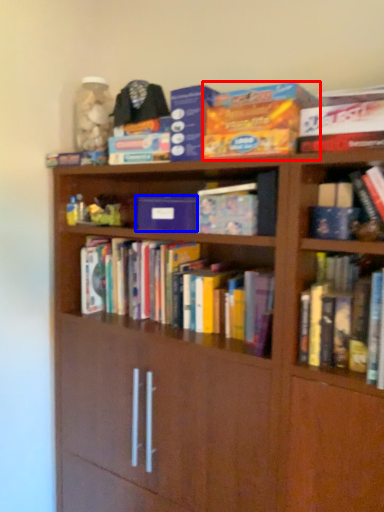
Question: Among these objects, which one is farthest to the camera, paperback book (highlighted by a red box) or paperback book (highlighted by a blue box)?

Choices:
 (A) paperback book
 (B) paperback book

Answer: (B)